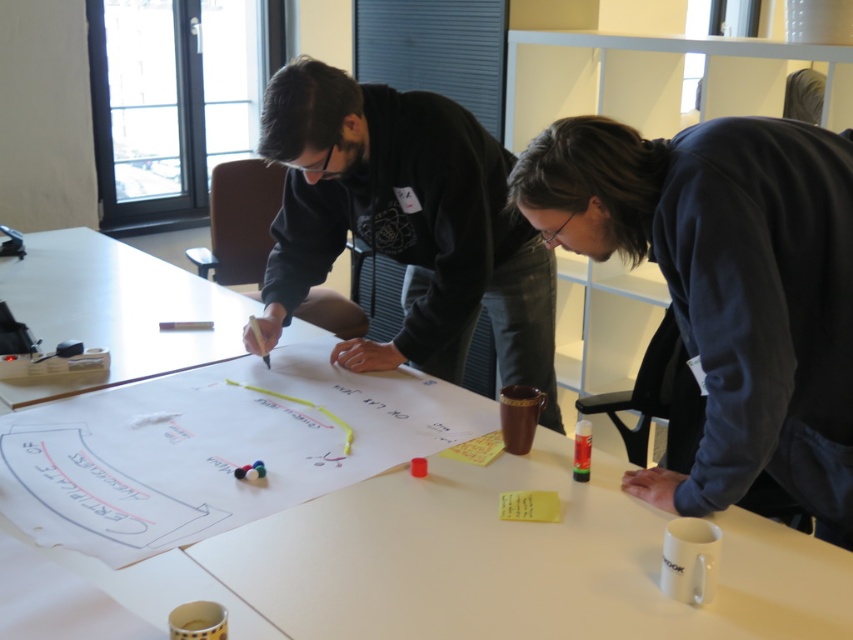
Question: Which point is farther to the camera?

Choices:
 (A) white paperboard at center
 (B) black matte hoodie at center
 (C) dark blue sweatshirt at center

Answer: (B)

Question: Can you confirm if white paperboard at center is positioned to the right of black matte hoodie at center?

Choices:
 (A) no
 (B) yes

Answer: (A)

Question: Does white paperboard at center have a smaller size compared to dark blue sweatshirt at center?

Choices:
 (A) no
 (B) yes

Answer: (A)

Question: Which object is positioned farthest from the black matte hoodie at center?

Choices:
 (A) dark blue sweatshirt at center
 (B) white paperboard at center

Answer: (A)

Question: Is dark blue sweatshirt at center further to the viewer compared to black matte hoodie at center?

Choices:
 (A) yes
 (B) no

Answer: (B)

Question: Which point is farther to the camera?

Choices:
 (A) (407, 621)
 (B) (445, 106)
 (C) (654, 182)

Answer: (B)